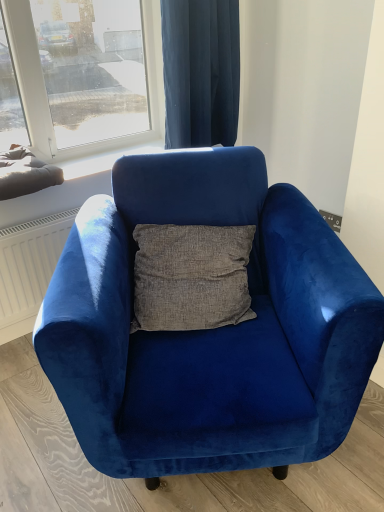
Question: Considering the positions of velvet blue armchair at center and velvet blue curtain at upper center in the image, is velvet blue armchair at center taller or shorter than velvet blue curtain at upper center?

Choices:
 (A) tall
 (B) short

Answer: (A)

Question: Considering their positions, is velvet blue armchair at center located in front of or behind velvet blue curtain at upper center?

Choices:
 (A) front
 (B) behind

Answer: (A)

Question: Considering the positions of point (87, 225) and point (196, 27), is point (87, 225) closer or farther from the camera than point (196, 27)?

Choices:
 (A) closer
 (B) farther

Answer: (A)

Question: Looking at their shapes, would you say velvet blue curtain at upper center is wider or thinner than velvet blue armchair at center?

Choices:
 (A) thin
 (B) wide

Answer: (A)

Question: Considering the positions of velvet blue curtain at upper center and velvet blue armchair at center in the image, is velvet blue curtain at upper center bigger or smaller than velvet blue armchair at center?

Choices:
 (A) big
 (B) small

Answer: (B)

Question: From the image's perspective, relative to velvet blue armchair at center, is velvet blue curtain at upper center above or below?

Choices:
 (A) below
 (B) above

Answer: (B)

Question: Would you say velvet blue curtain at upper center is inside or outside velvet blue armchair at center?

Choices:
 (A) outside
 (B) inside

Answer: (A)